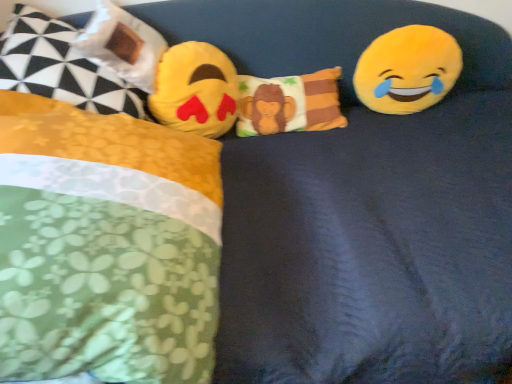
In order to click on yellow plush emoji at center, the 2th toy in the right-to-left sequence in this screenshot , I will do `click(196, 90)`.

What are the coordinates of `yellow plush emoji at upper right, which is the first toy from right to left` in the screenshot? It's located at (407, 70).

What do you see at coordinates (407, 70) in the screenshot?
I see `yellow plush emoji at upper right, which is the 2th toy from left to right` at bounding box center [407, 70].

The height and width of the screenshot is (384, 512). In order to click on floral fabric pillow at left, the 1th pillow in the left-to-right sequence in this screenshot , I will do `click(61, 67)`.

The image size is (512, 384). What do you see at coordinates (61, 67) in the screenshot?
I see `floral fabric pillow at left, the 1th pillow in the left-to-right sequence` at bounding box center [61, 67].

At what (x,y) coordinates should I click in order to perform the action: click on matte plastic bag at upper left, the 2th pillow from the left. Please return your answer as a coordinate pair (x, y). Looking at the image, I should click on (122, 45).

Can you confirm if matte plastic bag at upper left, the third pillow when ordered from right to left, is taller than fluffy cotton monkey pillow at center, which is the first pillow from right to left?

Yes, matte plastic bag at upper left, the third pillow when ordered from right to left, is taller than fluffy cotton monkey pillow at center, which is the first pillow from right to left.

Is matte plastic bag at upper left, the 2th pillow from the left, not inside fluffy cotton monkey pillow at center, the 4th pillow positioned from the left?

That's correct, matte plastic bag at upper left, the 2th pillow from the left, is outside of fluffy cotton monkey pillow at center, the 4th pillow positioned from the left.

Is point (108, 9) behind point (247, 122)?

No, (108, 9) is closer to viewer.

Is yellow plush emoji at center, positioned as the 1th toy in left-to-right order, at the back of floral fabric pillow at left, which ranks as the fourth pillow in right-to-left order?

No, floral fabric pillow at left, which ranks as the fourth pillow in right-to-left order, is not facing the opposite direction of yellow plush emoji at center, positioned as the 1th toy in left-to-right order.

Which object is wider, floral fabric pillow at left, the 1th pillow in the left-to-right sequence, or yellow plush emoji at center, positioned as the 1th toy in left-to-right order?

With larger width is floral fabric pillow at left, the 1th pillow in the left-to-right sequence.

At what (x,y) coordinates should I click in order to perform the action: click on the 2nd pillow in front of the yellow plush emoji at center, positioned as the 1th toy in left-to-right order. Please return your answer as a coordinate pair (x, y). The width and height of the screenshot is (512, 384). Looking at the image, I should click on (61, 67).

Between yellow plush emoji at upper right, which is the 2th toy from left to right, and yellow plush emoji at center, positioned as the 1th toy in left-to-right order, which one appears on the left side from the viewer's perspective?

yellow plush emoji at center, positioned as the 1th toy in left-to-right order, is more to the left.

From the image's perspective, is yellow plush emoji at upper right, which is the first toy from right to left, above or below yellow plush emoji at center, the 2th toy in the right-to-left sequence?

yellow plush emoji at upper right, which is the first toy from right to left, is above yellow plush emoji at center, the 2th toy in the right-to-left sequence.

Is the position of yellow plush emoji at upper right, which is the first toy from right to left, less distant than that of yellow plush emoji at center, the 2th toy in the right-to-left sequence?

No, it is not.

Could yellow plush emoji at center, positioned as the 1th toy in left-to-right order, be considered to be inside yellow plush emoji at upper right, which is the first toy from right to left?

No, yellow plush emoji at center, positioned as the 1th toy in left-to-right order, is not surrounded by yellow plush emoji at upper right, which is the first toy from right to left.

Considering the relative sizes of yellow plush emoji at center, positioned as the 1th toy in left-to-right order, and floral fabric pillow at left, the 1th pillow in the left-to-right sequence, in the image provided, is yellow plush emoji at center, positioned as the 1th toy in left-to-right order, wider than floral fabric pillow at left, the 1th pillow in the left-to-right sequence,?

Incorrect, the width of yellow plush emoji at center, positioned as the 1th toy in left-to-right order, does not surpass that of floral fabric pillow at left, the 1th pillow in the left-to-right sequence.

From the picture: From a real-world perspective, is yellow plush emoji at center, the 2th toy in the right-to-left sequence, physically above floral fabric pillow at left, which ranks as the fourth pillow in right-to-left order?

Incorrect, from a real-world perspective, yellow plush emoji at center, the 2th toy in the right-to-left sequence, is lower than floral fabric pillow at left, which ranks as the fourth pillow in right-to-left order.

Is point (173, 51) positioned before point (84, 65)?

No, (173, 51) is behind (84, 65).

Considering the points (33, 80) and (213, 270), which point is behind, point (33, 80) or point (213, 270)?

Point (33, 80)

Considering the sizes of floral fabric pillow at left, which ranks as the fourth pillow in right-to-left order, and fluffy yellow pillow at left, acting as the 2th pillow starting from the right, in the image, is floral fabric pillow at left, which ranks as the fourth pillow in right-to-left order, taller or shorter than fluffy yellow pillow at left, acting as the 2th pillow starting from the right,?

Considering their sizes, floral fabric pillow at left, which ranks as the fourth pillow in right-to-left order, has less height than fluffy yellow pillow at left, acting as the 2th pillow starting from the right.

From a real-world perspective, is floral fabric pillow at left, which ranks as the fourth pillow in right-to-left order, positioned above or below fluffy yellow pillow at left, acting as the 2th pillow starting from the right?

floral fabric pillow at left, which ranks as the fourth pillow in right-to-left order, is situated higher than fluffy yellow pillow at left, acting as the 2th pillow starting from the right, in the real world.

From the image's perspective, relative to fluffy yellow pillow at left, acting as the 2th pillow starting from the right, is floral fabric pillow at left, which ranks as the fourth pillow in right-to-left order, above or below?

From the image's perspective, floral fabric pillow at left, which ranks as the fourth pillow in right-to-left order, appears above fluffy yellow pillow at left, acting as the 2th pillow starting from the right.

Is point (161, 152) behind point (269, 96)?

No, it is in front of (269, 96).

Considering the relative sizes of fluffy yellow pillow at left, acting as the 2th pillow starting from the right, and fluffy cotton monkey pillow at center, the 4th pillow positioned from the left, in the image provided, is fluffy yellow pillow at left, acting as the 2th pillow starting from the right, shorter than fluffy cotton monkey pillow at center, the 4th pillow positioned from the left,?

In fact, fluffy yellow pillow at left, acting as the 2th pillow starting from the right, may be taller than fluffy cotton monkey pillow at center, the 4th pillow positioned from the left.

Could you measure the distance between fluffy yellow pillow at left, arranged as the 3th pillow when viewed from the left, and fluffy cotton monkey pillow at center, which is the first pillow from right to left?

They are 61.59 centimeters apart.

Looking at their sizes, would you say fluffy yellow pillow at left, acting as the 2th pillow starting from the right, is wider or thinner than fluffy cotton monkey pillow at center, the 4th pillow positioned from the left?

Clearly, fluffy yellow pillow at left, acting as the 2th pillow starting from the right, has more width compared to fluffy cotton monkey pillow at center, the 4th pillow positioned from the left.

Who is more distant, fluffy cotton monkey pillow at center, which is the first pillow from right to left, or yellow plush emoji at upper right, which is the 2th toy from left to right?

→ fluffy cotton monkey pillow at center, which is the first pillow from right to left, is behind.

Where is `pillow that appears below the yellow plush emoji at upper right, which is the first toy from right to left (from a real-world perspective)`? pillow that appears below the yellow plush emoji at upper right, which is the first toy from right to left (from a real-world perspective) is located at coordinates (289, 104).

Can you confirm if fluffy cotton monkey pillow at center, the 4th pillow positioned from the left, is wider than yellow plush emoji at upper right, which is the first toy from right to left?

Yes.

Can you tell me how much fluffy cotton monkey pillow at center, which is the first pillow from right to left, and yellow plush emoji at upper right, which is the first toy from right to left, differ in facing direction?

6.14 degrees.

Locate an element on the screen. the 3rd pillow located above the fluffy cotton monkey pillow at center, the 4th pillow positioned from the left (from a real-world perspective) is located at coordinates (122, 45).

From a real-world perspective, starting from the floral fabric pillow at left, which ranks as the fourth pillow in right-to-left order, which toy is the 1st one below it? Please provide its 2D coordinates.

[(196, 90)]

Based on their spatial positions, is fluffy cotton monkey pillow at center, which is the first pillow from right to left, or matte plastic bag at upper left, the 2th pillow from the left, further from yellow plush emoji at upper right, which is the first toy from right to left?

The object further to yellow plush emoji at upper right, which is the first toy from right to left, is matte plastic bag at upper left, the 2th pillow from the left.

From the image, which object appears to be farther from yellow plush emoji at center, the 2th toy in the right-to-left sequence, matte plastic bag at upper left, the third pillow when ordered from right to left, or fluffy cotton monkey pillow at center, which is the first pillow from right to left?

Among the two, fluffy cotton monkey pillow at center, which is the first pillow from right to left, is located further to yellow plush emoji at center, the 2th toy in the right-to-left sequence.

Based on their spatial positions, is floral fabric pillow at left, which ranks as the fourth pillow in right-to-left order, or matte plastic bag at upper left, the third pillow when ordered from right to left, closer to fluffy yellow pillow at left, arranged as the 3th pillow when viewed from the left?

Among the two, floral fabric pillow at left, which ranks as the fourth pillow in right-to-left order, is located nearer to fluffy yellow pillow at left, arranged as the 3th pillow when viewed from the left.

Considering their positions, is fluffy cotton monkey pillow at center, the 4th pillow positioned from the left, positioned closer to floral fabric pillow at left, which ranks as the fourth pillow in right-to-left order, than fluffy yellow pillow at left, arranged as the 3th pillow when viewed from the left?

fluffy yellow pillow at left, arranged as the 3th pillow when viewed from the left, is positioned closer to the anchor floral fabric pillow at left, which ranks as the fourth pillow in right-to-left order.

Looking at the image, which one is located further to matte plastic bag at upper left, the third pillow when ordered from right to left, fluffy cotton monkey pillow at center, the 4th pillow positioned from the left, or fluffy yellow pillow at left, arranged as the 3th pillow when viewed from the left?

Among the two, fluffy yellow pillow at left, arranged as the 3th pillow when viewed from the left, is located further to matte plastic bag at upper left, the third pillow when ordered from right to left.

Estimate the real-world distances between objects in this image. Which object is further from fluffy cotton monkey pillow at center, which is the first pillow from right to left, yellow plush emoji at upper right, which is the 2th toy from left to right, or fluffy yellow pillow at left, arranged as the 3th pillow when viewed from the left?

The object further to fluffy cotton monkey pillow at center, which is the first pillow from right to left, is fluffy yellow pillow at left, arranged as the 3th pillow when viewed from the left.

From the image, which object appears to be farther from yellow plush emoji at center, positioned as the 1th toy in left-to-right order, fluffy yellow pillow at left, acting as the 2th pillow starting from the right, or fluffy cotton monkey pillow at center, which is the first pillow from right to left?

fluffy yellow pillow at left, acting as the 2th pillow starting from the right, lies further to yellow plush emoji at center, positioned as the 1th toy in left-to-right order, than the other object.

From the image, which object appears to be farther from matte plastic bag at upper left, the 2th pillow from the left, fluffy yellow pillow at left, arranged as the 3th pillow when viewed from the left, or yellow plush emoji at upper right, which is the first toy from right to left?

The object further to matte plastic bag at upper left, the 2th pillow from the left, is yellow plush emoji at upper right, which is the first toy from right to left.

You are a GUI agent. You are given a task and a screenshot of the screen. Output one action in this format:
    pyautogui.click(x=<x>, y=<y>)
    Task: Click on the toy between floral fabric pillow at left, the 1th pillow in the left-to-right sequence, and fluffy cotton monkey pillow at center, which is the first pillow from right to left
    
    Given the screenshot: What is the action you would take?
    pyautogui.click(x=196, y=90)

Locate an element on the screen. The image size is (512, 384). toy between floral fabric pillow at left, which ranks as the fourth pillow in right-to-left order, and yellow plush emoji at upper right, which is the 2th toy from left to right is located at coordinates (196, 90).

Identify the location of pillow positioned between fluffy yellow pillow at left, arranged as the 3th pillow when viewed from the left, and matte plastic bag at upper left, the third pillow when ordered from right to left, from near to far. (61, 67).

Where is `toy between fluffy yellow pillow at left, acting as the 2th pillow starting from the right, and yellow plush emoji at upper right, which is the 2th toy from left to right, in the horizontal direction`? toy between fluffy yellow pillow at left, acting as the 2th pillow starting from the right, and yellow plush emoji at upper right, which is the 2th toy from left to right, in the horizontal direction is located at coordinates (196, 90).